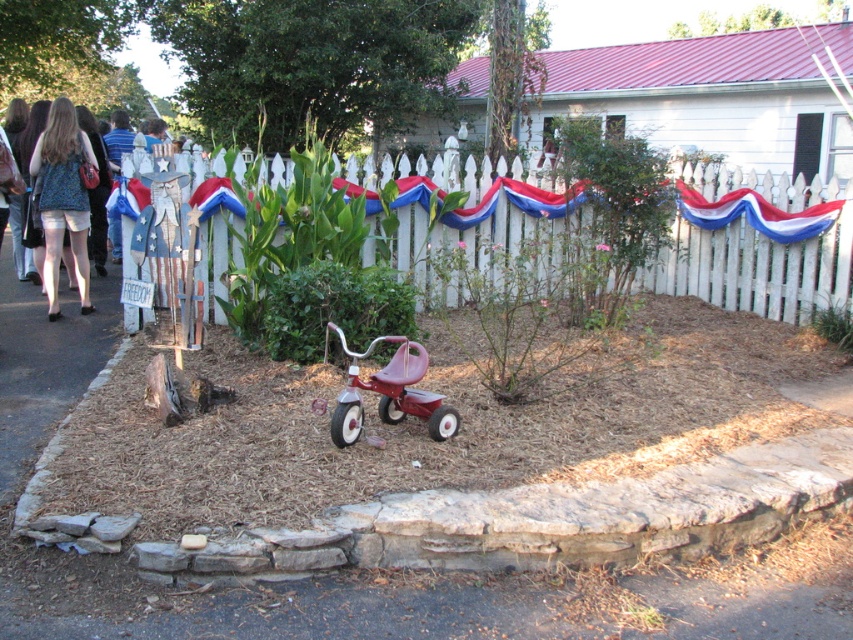
Can you confirm if white picket fence at center is positioned to the left of metallic red tricycle at center?

No, white picket fence at center is not to the left of metallic red tricycle at center.

Find the location of a particular element. white picket fence at center is located at coordinates (757, 250).

Between point (403, 262) and point (331, 413), which one is positioned behind?

The point (403, 262) is more distant.

Locate an element on the screen. This screenshot has width=853, height=640. white picket fence at center is located at coordinates (757, 250).

Which is below, white picket fence at center or denim shorts at left?

denim shorts at left

Measure the distance between white picket fence at center and denim shorts at left.

white picket fence at center and denim shorts at left are 10.00 feet apart.

Which is behind, point (389, 168) or point (65, 138)?

Positioned behind is point (389, 168).

Identify the location of white picket fence at center. (757, 250).

Does denim shorts at left have a lesser width compared to metallic red tricycle at center?

Correct, denim shorts at left's width is less than metallic red tricycle at center's.

You are a GUI agent. You are given a task and a screenshot of the screen. Output one action in this format:
    pyautogui.click(x=<x>, y=<y>)
    Task: Click on the denim shorts at left
    Image resolution: width=853 pixels, height=640 pixels.
    Given the screenshot: What is the action you would take?
    pyautogui.click(x=62, y=198)

Between point (79, 138) and point (407, 381), which one is positioned in front?

Point (407, 381) is in front.

Locate an element on the screen. The width and height of the screenshot is (853, 640). denim shorts at left is located at coordinates (62, 198).